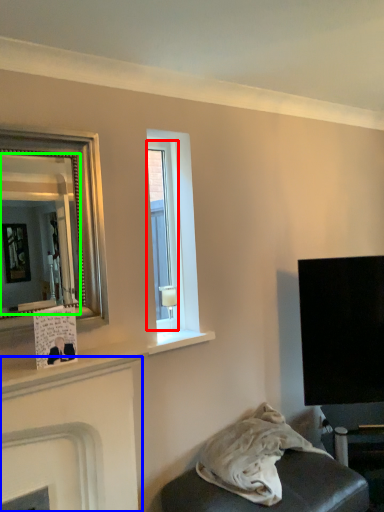
Question: Which is nearer to the window (highlighted by a red box)? fireplace (highlighted by a blue box) or mirror (highlighted by a green box).

Choices:
 (A) fireplace
 (B) mirror

Answer: (A)